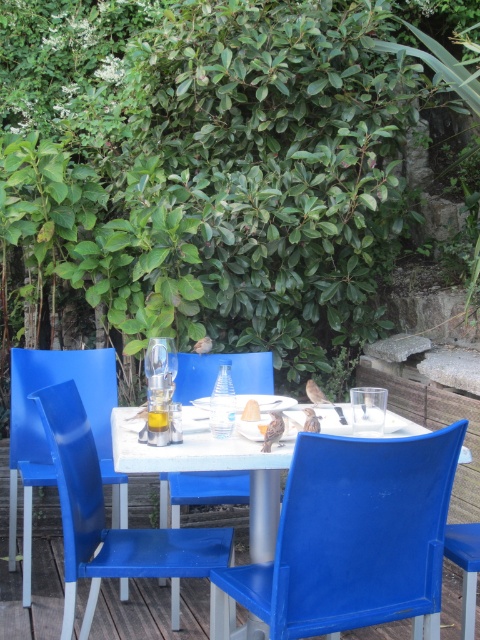
Does matte plastic chair at center have a greater height compared to glossy plastic chair at center?

No, matte plastic chair at center is not taller than glossy plastic chair at center.

Does point (422, 572) come closer to viewer compared to point (9, 545)?

Yes.

Measure the distance between matte plastic chair at center and camera.

5.70 feet

This screenshot has width=480, height=640. I want to click on matte plastic chair at center, so click(x=351, y=538).

Does point (25, 552) lie in front of point (197, 481)?

No, it is not.

Between point (88, 413) and point (249, 371), which one is positioned in front?

Point (88, 413) is in front.

Locate an element on the screen. glossy plastic chair at center is located at coordinates (45, 435).

Does point (158, 541) come closer to viewer compared to point (22, 426)?

That is True.

Describe the element at coordinates (105, 516) in the screenshot. I see `glossy plastic chair at left` at that location.

This screenshot has height=640, width=480. Describe the element at coordinates (105, 516) in the screenshot. I see `glossy plastic chair at left` at that location.

This screenshot has width=480, height=640. Identify the location of glossy plastic chair at left. (105, 516).